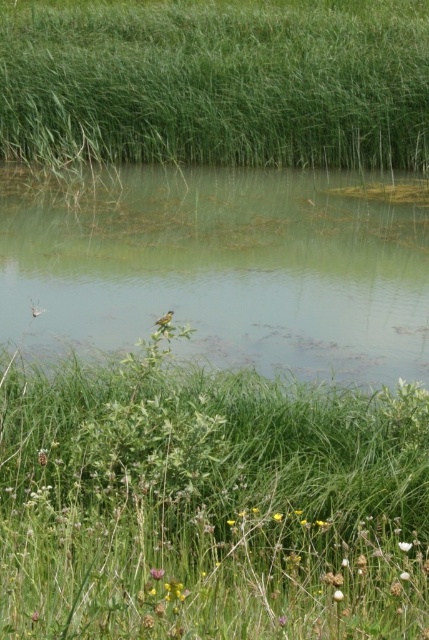
Question: Observing the image, what is the correct spatial positioning of green leafy grass at center in reference to green grass at upper center?

Choices:
 (A) below
 (B) above

Answer: (A)

Question: Which object is positioned closest to the green grassy lake at center?

Choices:
 (A) yellow-green textured bird at center
 (B) green leafy grass at center

Answer: (B)

Question: Can you confirm if green leafy grass at center is wider than green grassy lake at center?

Choices:
 (A) no
 (B) yes

Answer: (A)

Question: Which object is farther from the camera taking this photo?

Choices:
 (A) green leafy grass at center
 (B) yellow-green textured bird at center
 (C) green grass at upper center

Answer: (C)

Question: Is green grassy lake at center positioned before green grass at upper center?

Choices:
 (A) yes
 (B) no

Answer: (A)

Question: Which of the following is the closest to the observer?

Choices:
 (A) yellow-green textured bird at center
 (B) green leafy grass at center

Answer: (B)